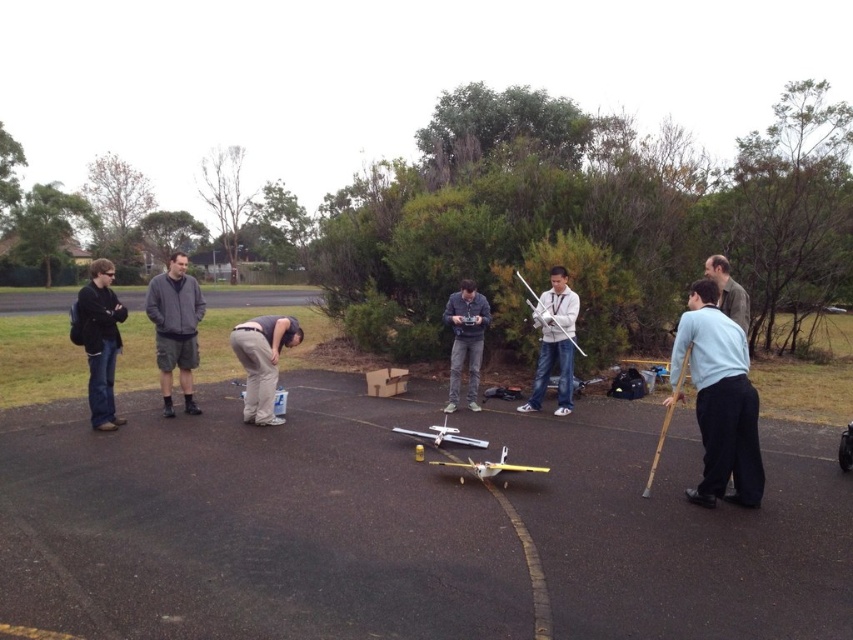
I want to click on dark gray cotton jacket at left, so click(175, 328).

Can you confirm if dark gray cotton jacket at left is thinner than matte gray shirt at center?

No.

Is point (173, 259) positioned after point (461, 289)?

No.

I want to click on dark gray cotton jacket at left, so click(175, 328).

Consider the image. Can you confirm if light blue fabric shirt at right is thinner than matte gray shirt at center?

In fact, light blue fabric shirt at right might be wider than matte gray shirt at center.

Is point (753, 493) closer to viewer compared to point (483, 301)?

Yes, it is.

Image resolution: width=853 pixels, height=640 pixels. What are the coordinates of `light blue fabric shirt at right` in the screenshot? It's located at (718, 400).

Where is `dark gray cotton jacket at left`? The image size is (853, 640). dark gray cotton jacket at left is located at coordinates (175, 328).